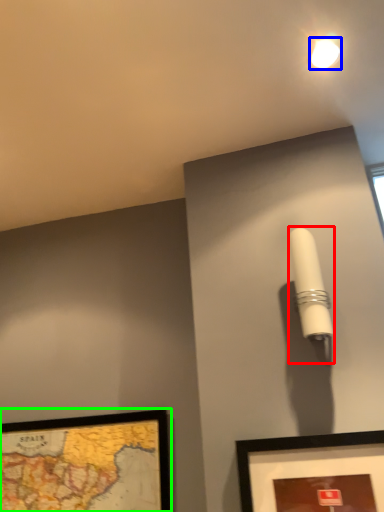
Question: Which is farther away from table lamp (highlighted by a red box)? droplight (highlighted by a blue box) or picture frame (highlighted by a green box)?

Choices:
 (A) droplight
 (B) picture frame

Answer: (B)